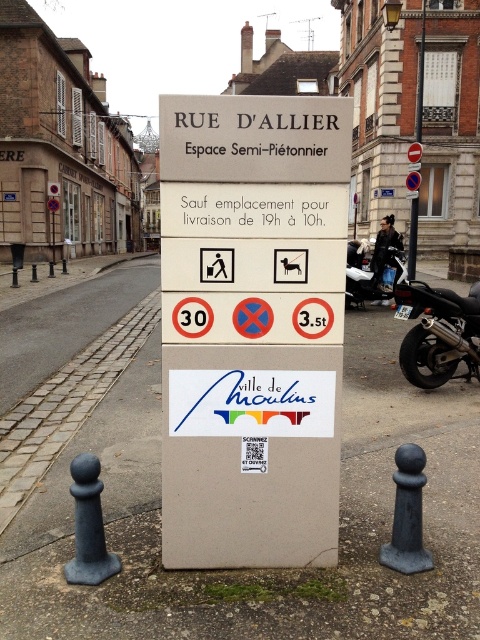
Question: Can you confirm if black matte motorcycle at center is positioned below metallic pole at center?

Choices:
 (A) no
 (B) yes

Answer: (B)

Question: Can you confirm if black matte motorcycle at center is wider than metallic pole at center?

Choices:
 (A) no
 (B) yes

Answer: (A)

Question: Which object appears closest to the camera in this image?

Choices:
 (A) metallic pole at center
 (B) beige plastic sign at center

Answer: (B)

Question: Which of the following is the closest to the observer?

Choices:
 (A) (395, 266)
 (B) (421, 22)
 (C) (240, 220)
 (D) (405, 346)

Answer: (C)

Question: Among these objects, which one is nearest to the camera?

Choices:
 (A) beige plastic sign at center
 (B) black matte motorcycle at center
 (C) black metallic motorcycle at right

Answer: (A)

Question: From the image, what is the correct spatial relationship of black metallic motorcycle at right in relation to black matte motorcycle at center?

Choices:
 (A) above
 (B) below

Answer: (B)